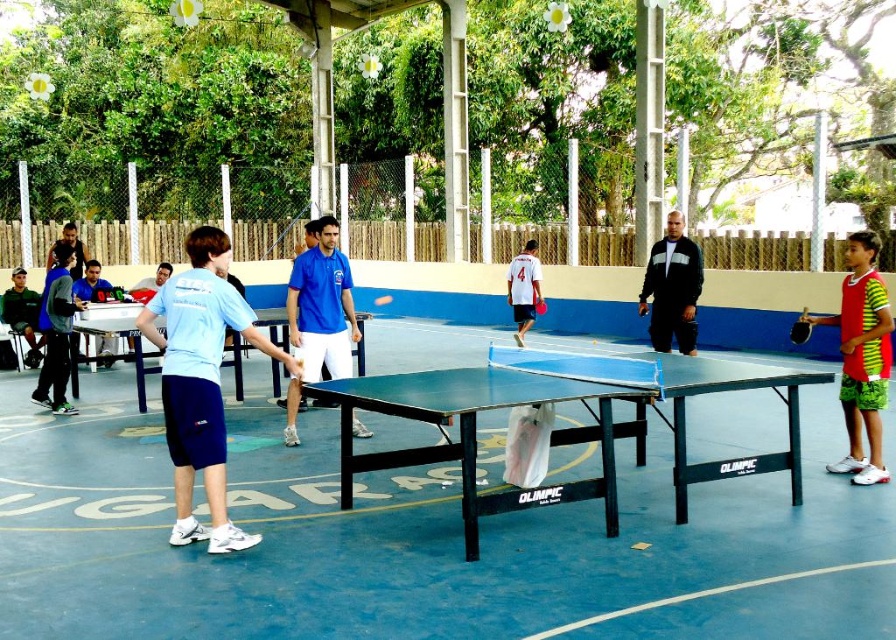
You are organizing a picnic and need to place the green fabric jacket at left and the blue plastic table tennis table at center. Given their sizes, which object should you prioritize placing first to ensure there is enough space?

The green fabric jacket at left is larger in size than the blue plastic table tennis table at center, so you should prioritize placing the green fabric jacket at left first to ensure there is enough space.

You are a photographer taking a picture of the blue plastic table tennis table at center and the green fabric jacket at left. Which object should you adjust your camera angle to focus on first if you want to capture both in the frame without moving the camera?

The green fabric jacket at left is positioned under the blue plastic table tennis table at center, so you should focus on the blue plastic table tennis table at center first to ensure it doesn not block the jacket.

Looking at this image, you are organizing a table tennis tournament and need to set up two tables. The minimum required distance between tables is 12 meters to ensure safety. Given the scene, can you confirm if the blue glossy table tennis table at center and the blue plastic table tennis table at center are placed appropriately?

The distance between the blue glossy table tennis table at center and the blue plastic table tennis table at center is 13.33 meters, which exceeds the minimum required 12 meters. Therefore, they are placed appropriately.